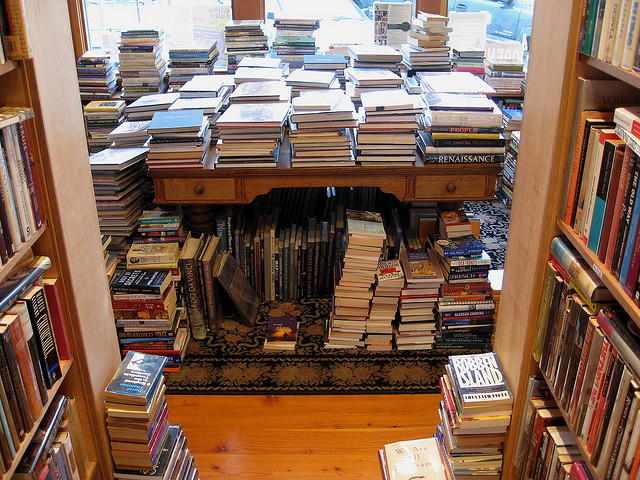
This screenshot has height=480, width=640. I want to click on drawer, so click(x=196, y=209).